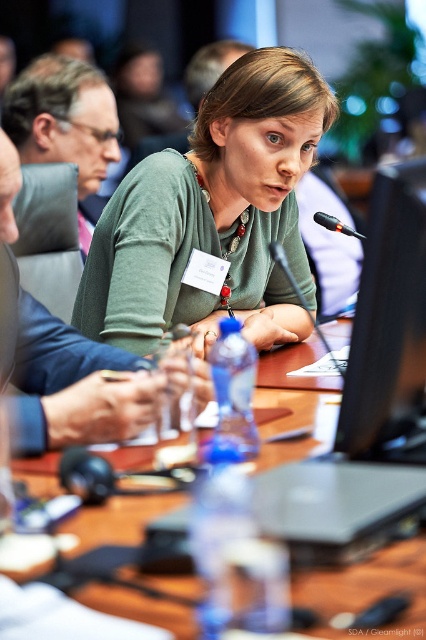
You are organizing a presentation and need to place a 15 cm wide laptop between the black glossy monitor at center right and the wooden table at center. Will the laptop fit horizontally between them?

The black glossy monitor at center right is narrower than the wooden table at center, so placing a 15 cm wide laptop between them horizontally would depend on the available space between their edges. However, since the monitor is narrower than the table, there might be sufficient space if positioned correctly.

You are standing at the entrance of the conference room and want to locate the speaker who is wearing the green matte shirt at center. According to the coordinates provided, where should you look to find them?

The green matte shirt at center is located at coordinates point (213,218), so you should look towards the lower middle area of the frame to find the speaker.